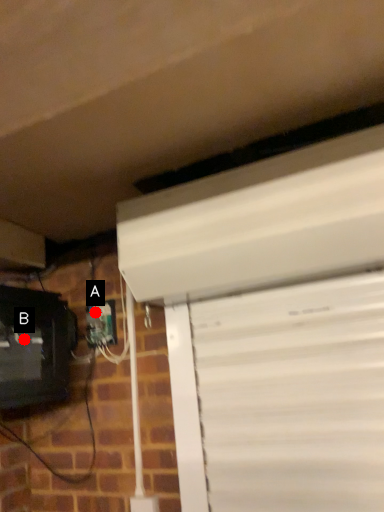
Question: Two points are circled on the image, labeled by A and B beside each circle. Which of the following is the closest to the observer?

Choices:
 (A) A is closer
 (B) B is closer

Answer: (A)